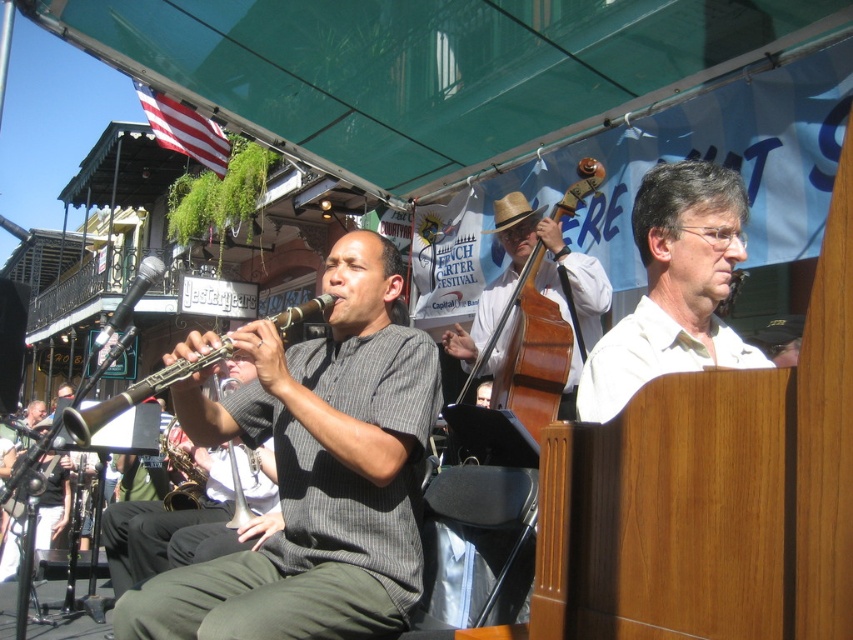
You are standing at the point labeled as point (723, 182) and want to walk towards the point labeled as point (273, 604). Which direction should you move?

You should move forward because point (273, 604) is in front of point (723, 182).

In the scene shown: You are a photographer at the event and want to capture both the white matte shirt at center and the brown wooden cello at center in a single shot. Which object should you focus on first to ensure both are in frame?

The white matte shirt at center is positioned on the right side of brown wooden cello at center, so you should focus on the brown wooden cello at center first to ensure both are in frame.

You are a photographer at the event and want to capture the musician in the gray striped shirt at center. Where should you position your camera to ensure the shirt is in the frame?

Position your camera at point [315,472] to capture the gray striped shirt at center.